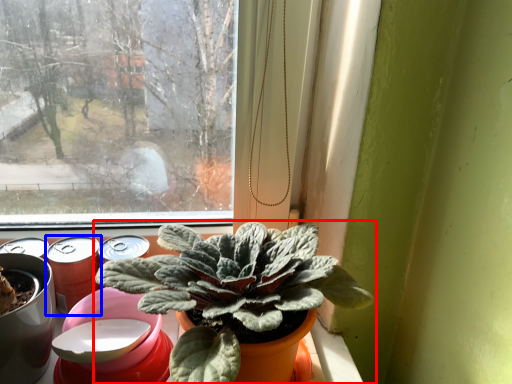
Question: Which object is further to the camera taking this photo, houseplant (highlighted by a red box) or beer (highlighted by a blue box)?

Choices:
 (A) houseplant
 (B) beer

Answer: (B)